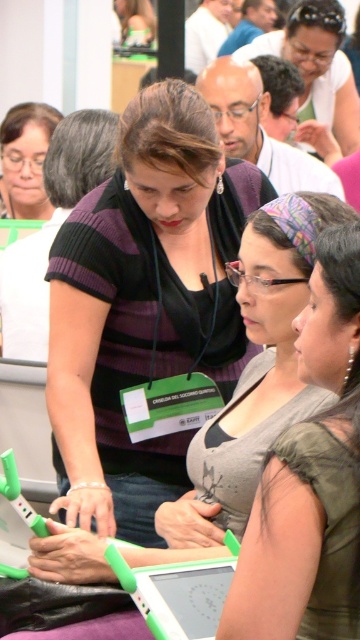
Does matte black shirt at center have a smaller size compared to gray matte tank top at center?

Actually, matte black shirt at center might be larger than gray matte tank top at center.

Who is shorter, matte black shirt at center or gray matte tank top at center?

Standing shorter between the two is gray matte tank top at center.

The height and width of the screenshot is (640, 360). I want to click on matte black shirt at center, so click(x=309, y=480).

Does purple striped shirt at center come in front of matte black shirt at center?

That is False.

Which of these two, purple striped shirt at center or matte black shirt at center, stands taller?

Standing taller between the two is purple striped shirt at center.

Does point (102, 211) come behind point (348, 305)?

Yes, it is behind point (348, 305).

Image resolution: width=360 pixels, height=640 pixels. I want to click on purple striped shirt at center, so click(x=144, y=305).

Between gray matte tank top at center and green plastic laptop at center, which one appears on the right side from the viewer's perspective?

gray matte tank top at center is more to the right.

Is point (321, 262) more distant than point (164, 625)?

Yes, point (321, 262) is farther from viewer.

Identify the location of gray matte tank top at center. The image size is (360, 640). (309, 480).